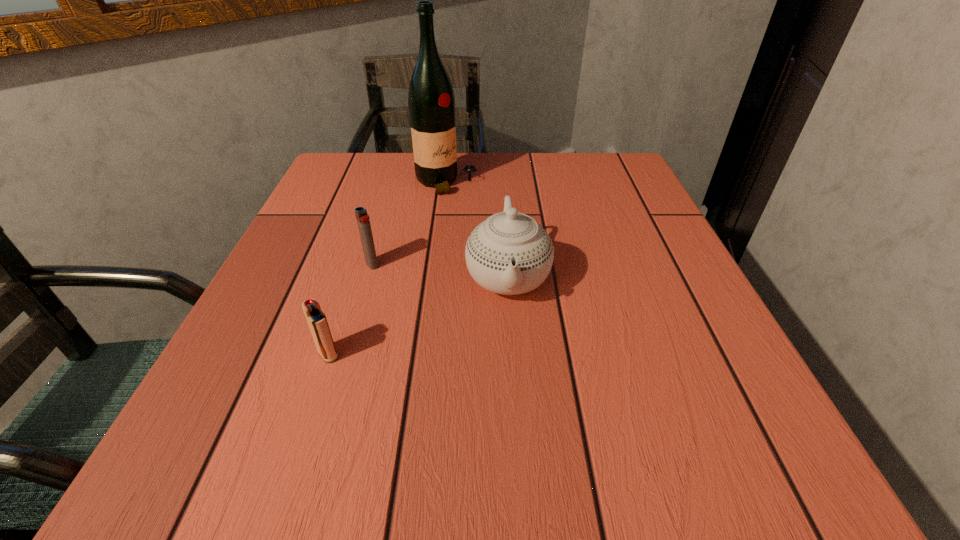
At what (x,y) coordinates should I click in order to perform the action: click on empty space that is in between the nearer igniter and the farthest object. Please return your answer as a coordinate pair (x, y). The image size is (960, 540). Looking at the image, I should click on (388, 268).

You are a GUI agent. You are given a task and a screenshot of the screen. Output one action in this format:
    pyautogui.click(x=<x>, y=<y>)
    Task: Click on the vacant region between the nearer igniter and the second tallest object
    The width and height of the screenshot is (960, 540).
    Given the screenshot: What is the action you would take?
    pyautogui.click(x=418, y=316)

The image size is (960, 540). Find the location of `unoccupied area between the nearer igniter and the chinaware`. unoccupied area between the nearer igniter and the chinaware is located at coordinates click(418, 316).

Where is `free area in between the chinaware and the farther igniter`? free area in between the chinaware and the farther igniter is located at coordinates (440, 271).

This screenshot has height=540, width=960. I want to click on free space between the second tallest object and the farther igniter, so click(440, 271).

Where is `empty location between the farther igniter and the nearest object`? This screenshot has height=540, width=960. empty location between the farther igniter and the nearest object is located at coordinates (350, 309).

Locate an element on the screen. This screenshot has width=960, height=540. the second closest object to the chinaware is located at coordinates (431, 101).

I want to click on object that can be found as the second closest to the nearest object, so click(x=509, y=253).

Image resolution: width=960 pixels, height=540 pixels. I want to click on vacant area that satisfies the following two spatial constraints: 1. on the back side of the nearer igniter; 2. on the left side of the farther igniter, so click(x=358, y=265).

This screenshot has height=540, width=960. I want to click on vacant space that satisfies the following two spatial constraints: 1. on the back side of the wine bottle; 2. on the right side of the nearer igniter, so click(385, 183).